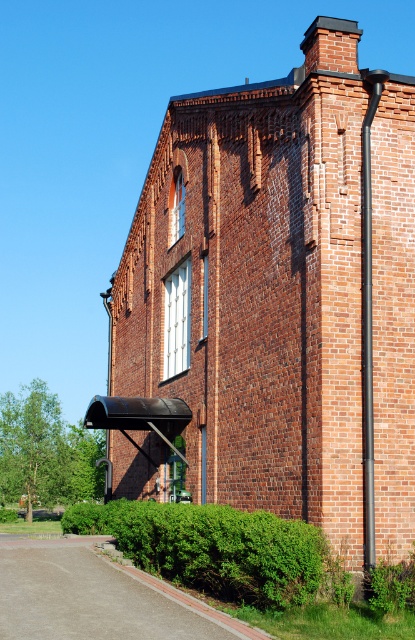
Does green leafy hedge at lower left have a greater height compared to black metal pipe at right?

No.

Which of these two, green leafy hedge at lower left or black metal pipe at right, stands taller?

With more height is black metal pipe at right.

Who is more forward, (156, 538) or (368, 330)?

Point (368, 330) is more forward.

The height and width of the screenshot is (640, 415). Identify the location of green leafy hedge at lower left. (212, 547).

Does brick chimney at upper right appear over green leafy hedge at lower left?

Correct, brick chimney at upper right is located above green leafy hedge at lower left.

Is brick chimney at upper right to the left of green leafy hedge at lower left from the viewer's perspective?

Incorrect, brick chimney at upper right is not on the left side of green leafy hedge at lower left.

Is point (283, 308) positioned behind point (193, 566)?

Yes.

Locate an element on the screen. brick chimney at upper right is located at coordinates tap(280, 298).

Which is below, brick chimney at upper right or black metal pipe at right?

black metal pipe at right is below.

Which is in front, point (402, 554) or point (368, 392)?

Point (402, 554)

Find the location of a particular element. The width and height of the screenshot is (415, 640). brick chimney at upper right is located at coordinates (280, 298).